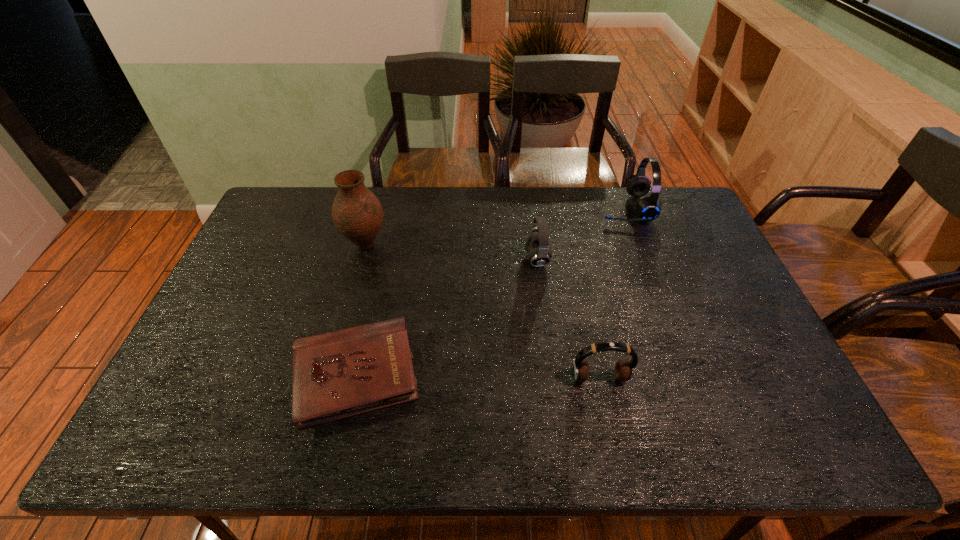
This screenshot has width=960, height=540. Identify the location of object at the far right corner. (648, 208).

The height and width of the screenshot is (540, 960). I want to click on free spot at the far edge of the desktop, so (x=607, y=200).

What are the coordinates of `vacant space at the left edge of the desktop` in the screenshot? It's located at (269, 305).

The image size is (960, 540). What are the coordinates of `free space at the right edge of the desktop` in the screenshot? It's located at (668, 257).

Identify the location of free area in between the second headset from left to right and the second farthest headset. This screenshot has width=960, height=540. (568, 319).

Where is `vacant area that lies between the shortest object and the second nearest headset`? The image size is (960, 540). vacant area that lies between the shortest object and the second nearest headset is located at coordinates (446, 318).

You are a GUI agent. You are given a task and a screenshot of the screen. Output one action in this format:
    pyautogui.click(x=<x>, y=<y>)
    Task: Click on the free space between the shortest object and the rightmost object
    The width and height of the screenshot is (960, 540).
    Given the screenshot: What is the action you would take?
    pyautogui.click(x=491, y=292)

Locate an element on the screen. empty location between the fourth shortest object and the hardback book is located at coordinates (491, 292).

Identify the location of blank region between the third object from left to right and the vase. (451, 252).

What are the coordinates of `vacant space that is in between the vase and the leftmost headset` in the screenshot? It's located at (451, 252).